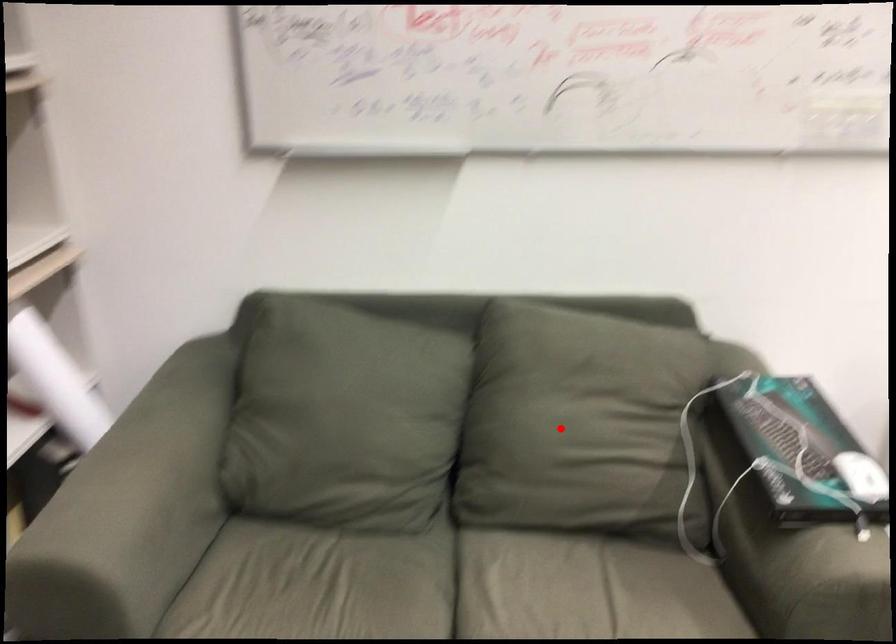
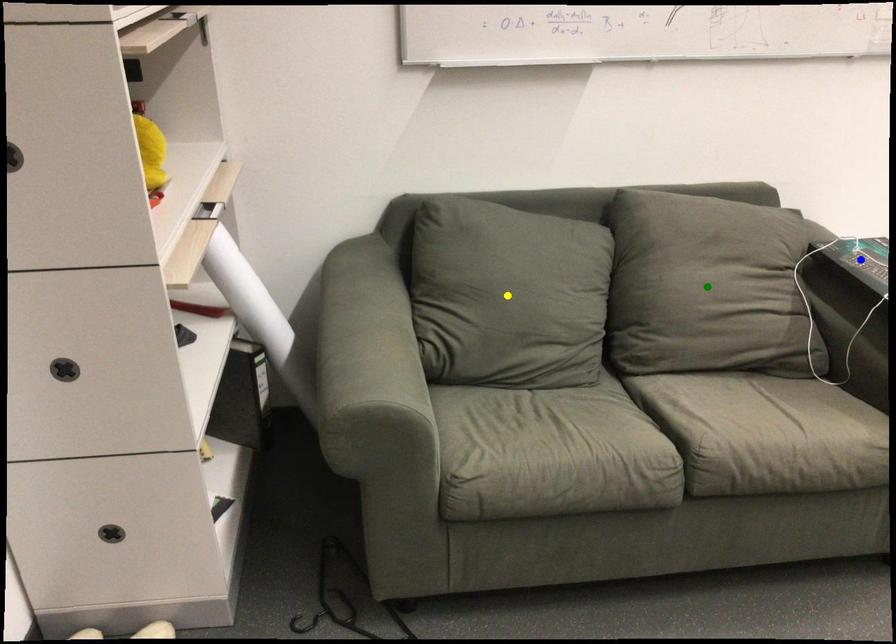
Question: I am providing you with two images of the same scene from different viewpoints. A red point is marked on the first image. You are given multiple points on the second image. Which point in image 2 is actually the same real-world point as the red point in image 1?

Choices:
 (A) blue point
 (B) green point
 (C) yellow point

Answer: (B)